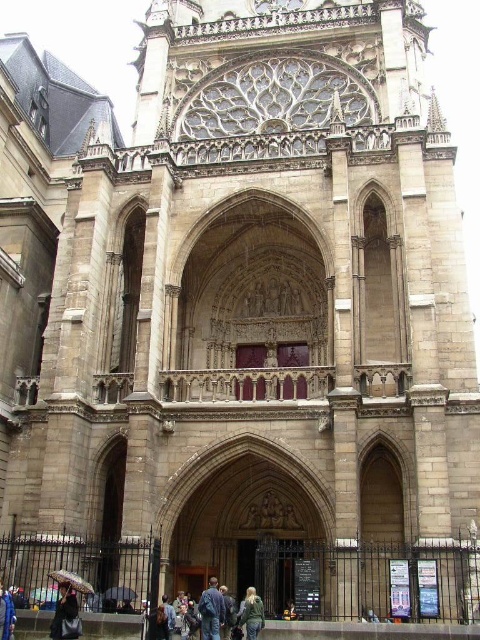
The width and height of the screenshot is (480, 640). What do you see at coordinates (211, 611) in the screenshot?
I see `denim jacket at lower center` at bounding box center [211, 611].

Locate an element on the screen. denim jacket at lower center is located at coordinates (211, 611).

Identify the location of denim jacket at lower center. This screenshot has height=640, width=480. (211, 611).

Does denim jacket at lower center lie behind black matte umbrella at lower left?

No, it is not.

Does denim jacket at lower center appear over black matte umbrella at lower left?

Incorrect, denim jacket at lower center is not positioned above black matte umbrella at lower left.

Is point (204, 628) more distant than point (38, 595)?

No.

Identify the location of denim jacket at lower center. Image resolution: width=480 pixels, height=640 pixels. (211, 611).

Who is positioned more to the right, green denim jacket at lower center or black matte umbrella at lower center?

Positioned to the right is green denim jacket at lower center.

Is the position of green denim jacket at lower center less distant than that of black matte umbrella at lower center?

Yes, it is in front of black matte umbrella at lower center.

Describe the element at coordinates (252, 612) in the screenshot. I see `green denim jacket at lower center` at that location.

Identify the location of green denim jacket at lower center. (252, 612).